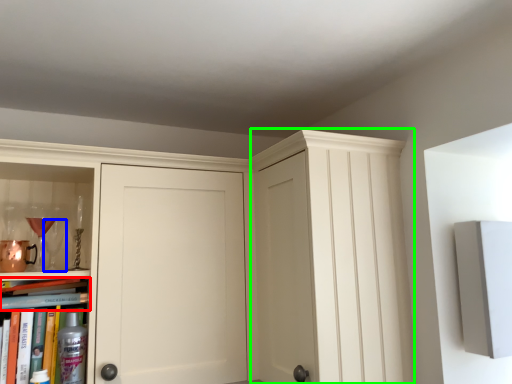
Question: Which object is positioned farthest from book (highlighted by a red box)? Select from wine glass (highlighted by a blue box) and glass door (highlighted by a green box).

Choices:
 (A) wine glass
 (B) glass door

Answer: (B)